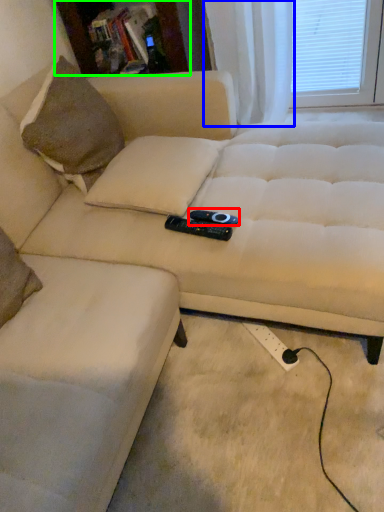
Question: Which is farther away from remote (highlighted by a red box)? curtain (highlighted by a blue box) or bookshelf (highlighted by a green box)?

Choices:
 (A) curtain
 (B) bookshelf

Answer: (B)